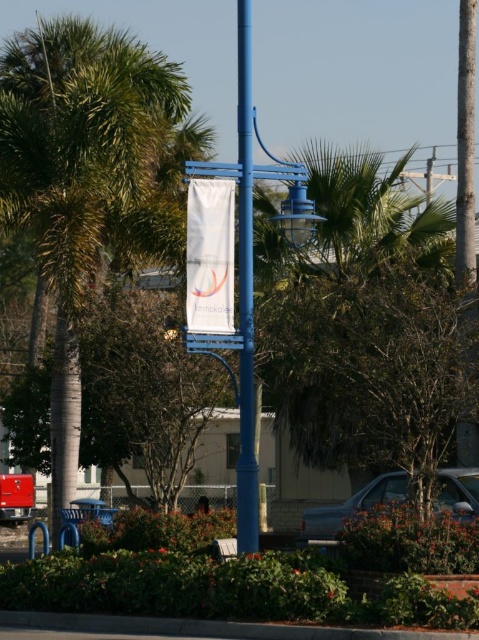
Question: Which point is farther from the camera taking this photo?

Choices:
 (A) (190, 221)
 (B) (239, 58)

Answer: (B)

Question: Is green leafy palm tree at left to the left of blue painted metal pole at center from the viewer's perspective?

Choices:
 (A) yes
 (B) no

Answer: (A)

Question: Which point is farther from the camera taking this photo?

Choices:
 (A) (341, 515)
 (B) (79, 54)

Answer: (B)

Question: Does blue painted metal pole at center appear on the left side of silver metallic sedan at center?

Choices:
 (A) no
 (B) yes

Answer: (B)

Question: Can you confirm if green leafy palm tree at left is bigger than silver metallic sedan at center?

Choices:
 (A) yes
 (B) no

Answer: (A)

Question: Which point is farther to the camera?

Choices:
 (A) (228, 321)
 (B) (397, 472)
 (C) (105, 115)

Answer: (C)